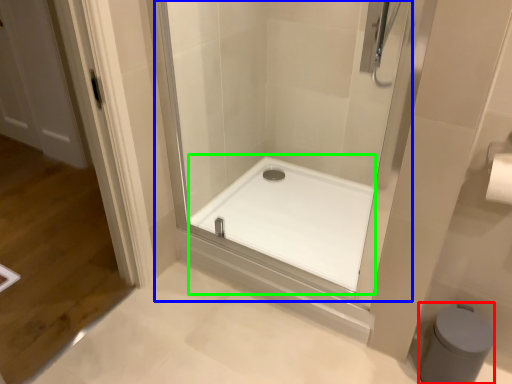
Question: Which is farther away from bidet (highlighted by a red box)? shower door (highlighted by a blue box) or bath (highlighted by a green box)?

Choices:
 (A) shower door
 (B) bath

Answer: (A)